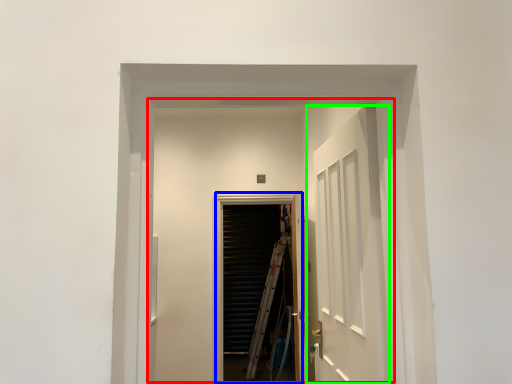
Question: Which is farther away from elevator (highlighted by a red box)? screen door (highlighted by a blue box) or door (highlighted by a green box)?

Choices:
 (A) screen door
 (B) door

Answer: (B)